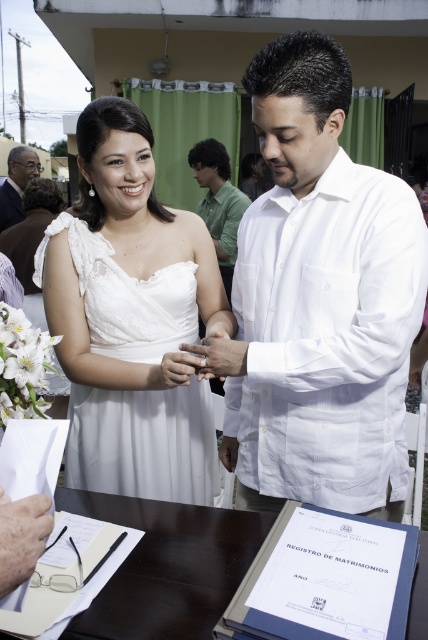
Is white satin dress at center below white matte ring at center?

Yes, white satin dress at center is below white matte ring at center.

Does white satin dress at center have a larger size compared to white matte ring at center?

Yes.

The width and height of the screenshot is (428, 640). In order to click on white satin dress at center in this screenshot , I will do tap(143, 442).

In the scene shown: Can you confirm if white satin dress at center is positioned below green matte shirt at center?

Yes, white satin dress at center is below green matte shirt at center.

Is point (139, 300) farther from viewer compared to point (213, 172)?

No, (139, 300) is closer to viewer.

Who is more distant from viewer, (121, 298) or (217, 218)?

The point (217, 218) is more distant.

The image size is (428, 640). Find the location of `white satin dress at center`. white satin dress at center is located at coordinates (143, 442).

Does matte black suit at left appear over white matte ring at center?

Yes, matte black suit at left is above white matte ring at center.

Which is more to the right, matte black suit at left or white matte ring at center?

white matte ring at center

The image size is (428, 640). Identify the location of matte black suit at left. (17, 182).